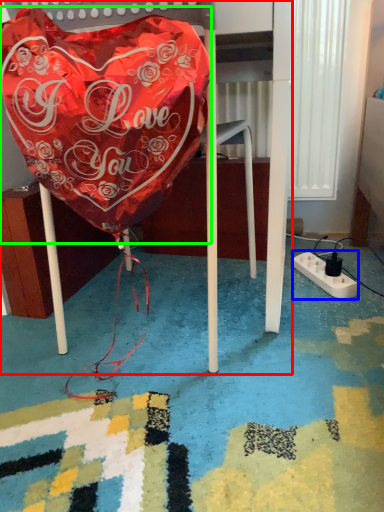
Question: Considering the real-world distances, which object is closest to furniture (highlighted by a red box)? extension cord (highlighted by a blue box) or blanket (highlighted by a green box).

Choices:
 (A) extension cord
 (B) blanket

Answer: (B)